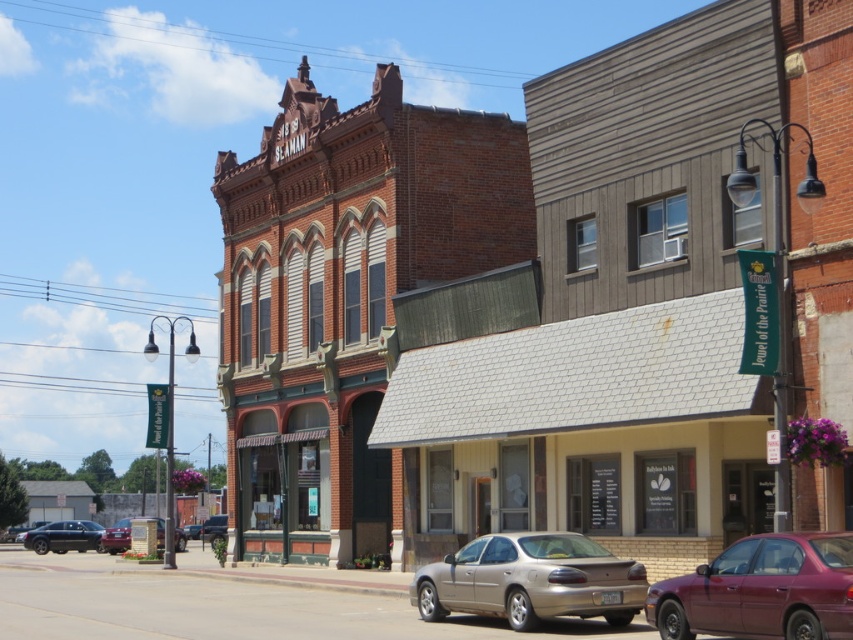
Question: Among these points, which one is nearest to the camera?

Choices:
 (A) (625, 570)
 (B) (683, 602)
 (C) (94, 532)

Answer: (B)

Question: Can you confirm if beige wood storefront at center is wider than gold metallic sedan at center?

Choices:
 (A) no
 (B) yes

Answer: (B)

Question: Which point is closer to the camera taking this photo?

Choices:
 (A) (428, 586)
 (B) (199, 525)
 (C) (80, 538)
 (D) (804, 628)

Answer: (D)

Question: Can you confirm if beige wood storefront at center is thinner than gold metallic sedan at center?

Choices:
 (A) no
 (B) yes

Answer: (A)

Question: Which point is closer to the camera taking this photo?

Choices:
 (A) (22, 541)
 (B) (490, 442)

Answer: (B)

Question: Is shiny black sedan at lower left wider than metallic silver sedan at center?

Choices:
 (A) no
 (B) yes

Answer: (B)